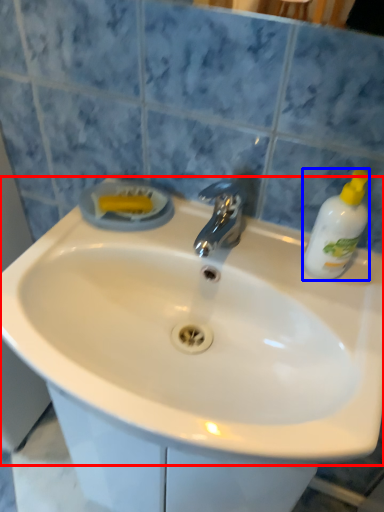
Question: Among these objects, which one is farthest to the camera, sink (highlighted by a red box) or cleaning product (highlighted by a blue box)?

Choices:
 (A) sink
 (B) cleaning product

Answer: (B)